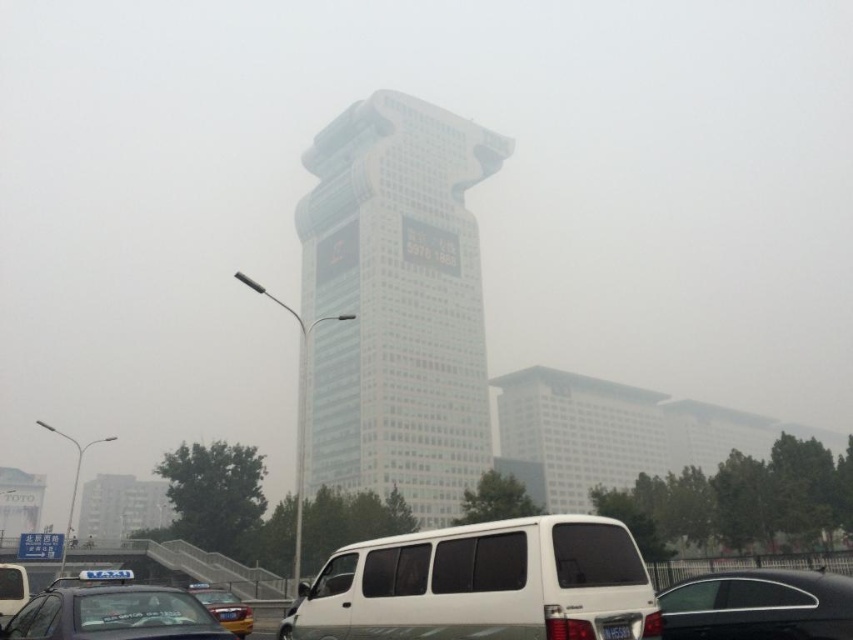
You are a pedestrian standing on the sidewalk and see the matte black taxi at lower left and the black plastic license plate at center. Which object is closer to you?

The matte black taxi at lower left is closer to you because it is positioned further to the viewer than the black plastic license plate at center.

You are a delivery driver who needs to park your vehicle between the matte black taxi at lower left and the black plastic license plate at center. Given that your delivery van is 6 meters long, can you fit it in the space between them without moving either object?

The distance between the matte black taxi at lower left and the black plastic license plate at center is 9.47 meters. Since your delivery van is 6 meters long, it can fit in the space between them as 6 meters is less than 9.47 meters.